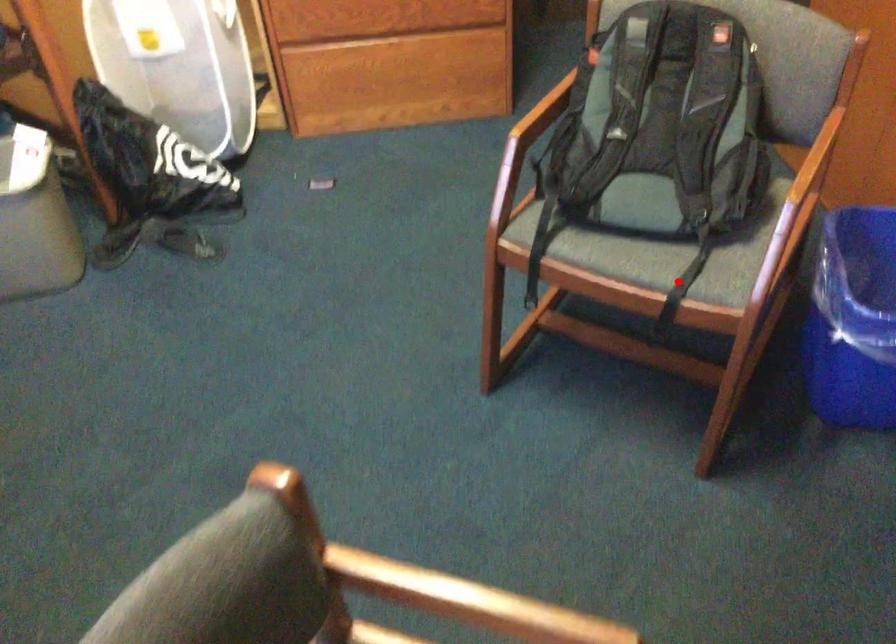
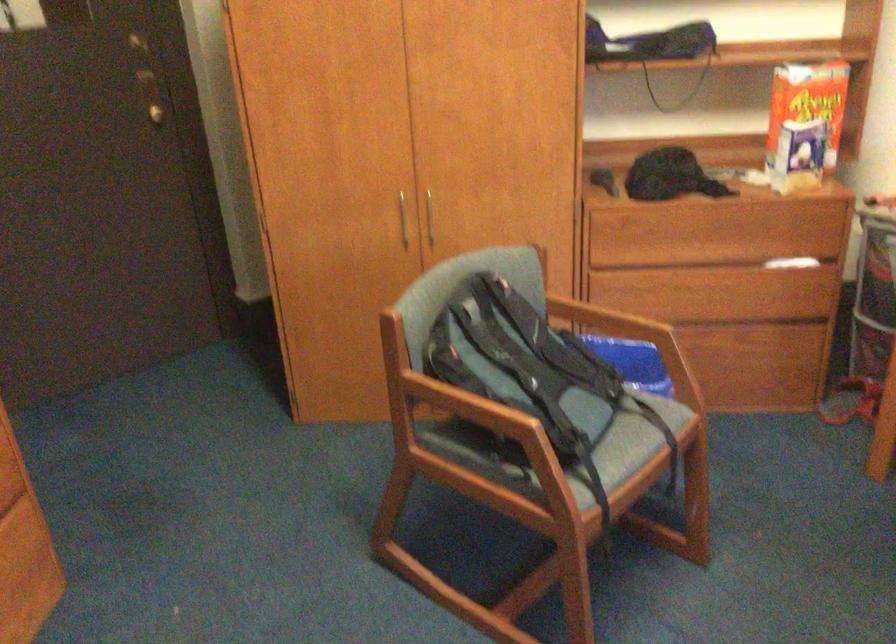
Where in the second image is the point corresponding to the highlighted location from the first image?

(631, 444)